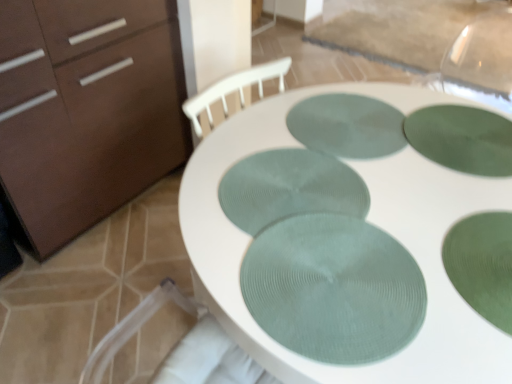
Where is `free space in front of green textured glass plate at upper right, placed as the 2th glass plate when sorted from back to front`? Image resolution: width=512 pixels, height=384 pixels. free space in front of green textured glass plate at upper right, placed as the 2th glass plate when sorted from back to front is located at coordinates (449, 223).